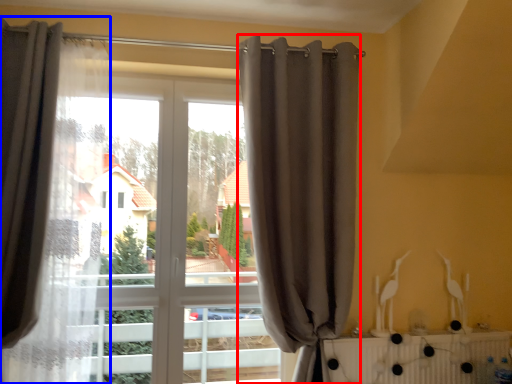
Question: Which object is further to the camera taking this photo, curtain (highlighted by a red box) or curtain (highlighted by a blue box)?

Choices:
 (A) curtain
 (B) curtain

Answer: (A)